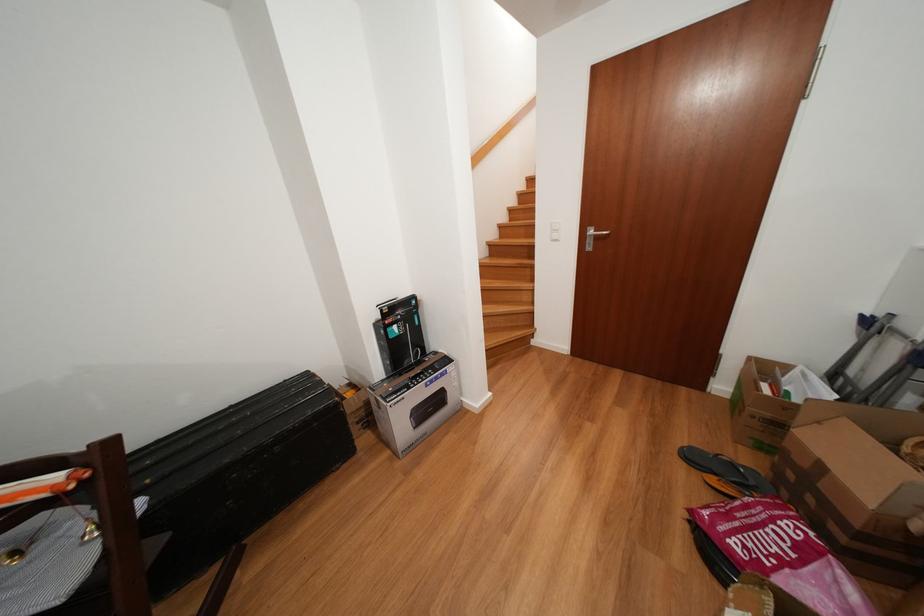
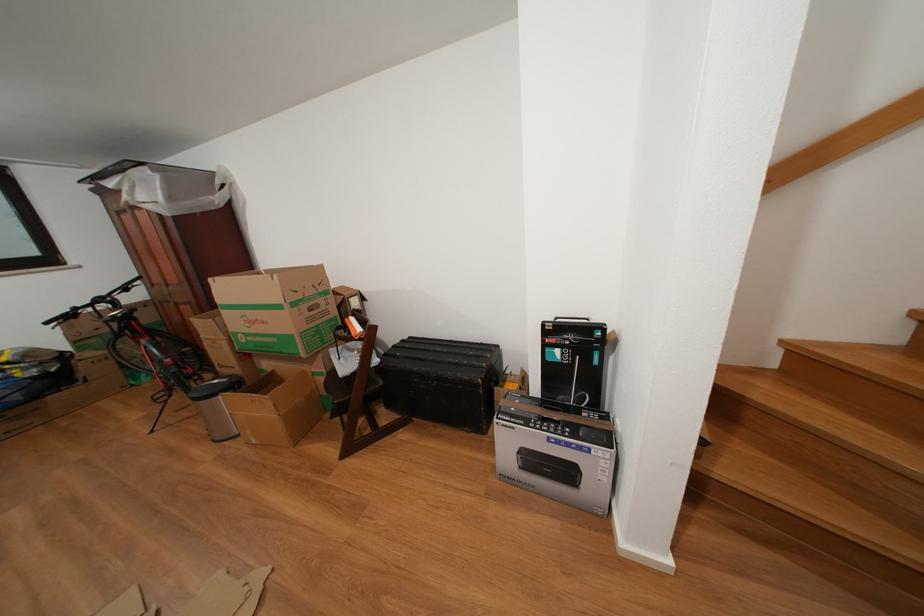
In the second image, find the point that corresponds to (444,384) in the first image.

(576, 450)